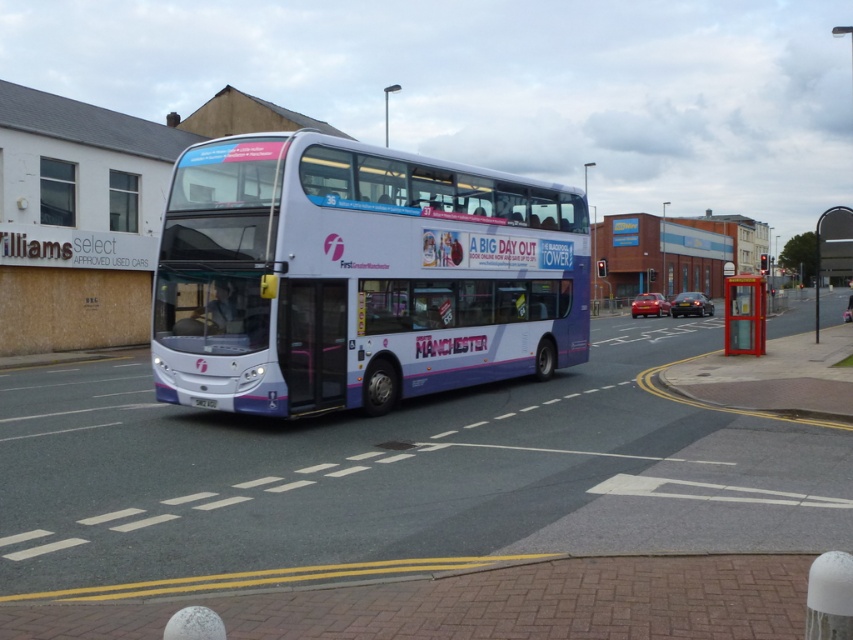
Question: Considering the relative positions of white glossy bus at center and white plastic license plate at center in the image provided, where is white glossy bus at center located with respect to white plastic license plate at center?

Choices:
 (A) right
 (B) left

Answer: (A)

Question: Which object is closer to the camera taking this photo?

Choices:
 (A) white glossy bus at center
 (B) metallic bus stop at right
 (C) white plastic license plate at center

Answer: (A)

Question: Does metallic bus stop at right have a greater width compared to white plastic license plate at center?

Choices:
 (A) yes
 (B) no

Answer: (A)

Question: Which point is closer to the camera?

Choices:
 (A) white glossy bus at center
 (B) white plastic license plate at center

Answer: (A)

Question: Among these objects, which one is nearest to the camera?

Choices:
 (A) white plastic license plate at center
 (B) metallic bus stop at right
 (C) white glossy bus at center

Answer: (C)

Question: Does white glossy bus at center have a smaller size compared to metallic bus stop at right?

Choices:
 (A) yes
 (B) no

Answer: (A)